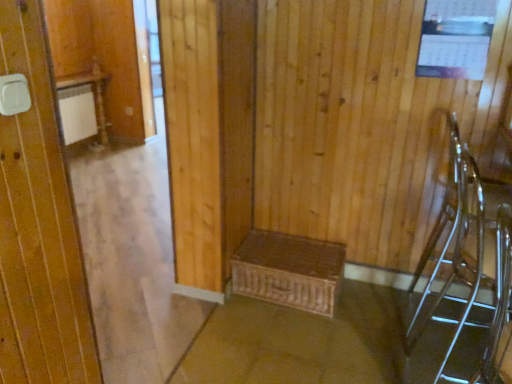
Locate an element on the screen. This screenshot has width=512, height=384. free spot in front of woven brown chest at center is located at coordinates (295, 345).